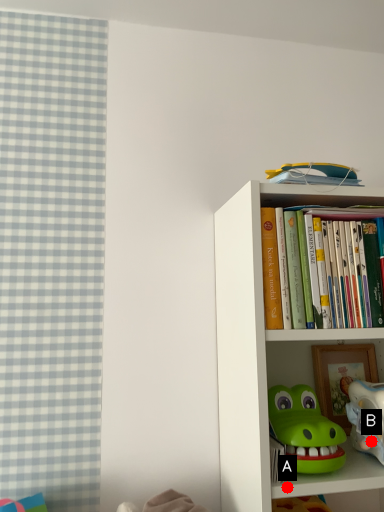
Question: Two points are circled on the image, labeled by A and B beside each circle. Which point is closer to the camera?

Choices:
 (A) A is closer
 (B) B is closer

Answer: (A)